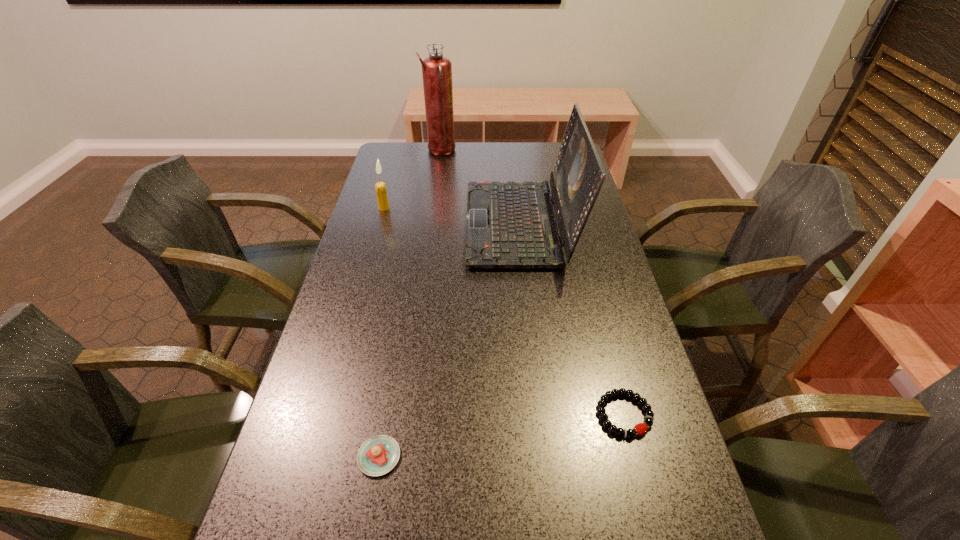
Where is `the farthest object`? the farthest object is located at coordinates point(436,69).

You are a GUI agent. You are given a task and a screenshot of the screen. Output one action in this format:
    pyautogui.click(x=<x>, y=<y>)
    Task: Click on the tallest object
    Image resolution: width=960 pixels, height=540 pixels.
    Given the screenshot: What is the action you would take?
    pyautogui.click(x=436, y=69)

Image resolution: width=960 pixels, height=540 pixels. Find the location of `laptop computer`. laptop computer is located at coordinates (510, 225).

The width and height of the screenshot is (960, 540). What are the coordinates of `the leftmost object` in the screenshot? It's located at (380, 187).

Find the location of a particular element. The image size is (960, 540). the third shortest object is located at coordinates (380, 187).

In order to click on the fourth tallest object in this screenshot , I will do `click(378, 455)`.

Locate an element on the screen. This screenshot has height=540, width=960. the shortest object is located at coordinates (640, 428).

Find the location of a particular element. This screenshot has height=540, width=960. vacant space located 0.120m on the side of the tallest object with the label is located at coordinates pyautogui.click(x=486, y=151).

Image resolution: width=960 pixels, height=540 pixels. Identify the location of vacant position located 0.300m on the screen of the laptop computer. click(371, 224).

This screenshot has width=960, height=540. I want to click on vacant space located 0.070m on the screen of the laptop computer, so click(444, 224).